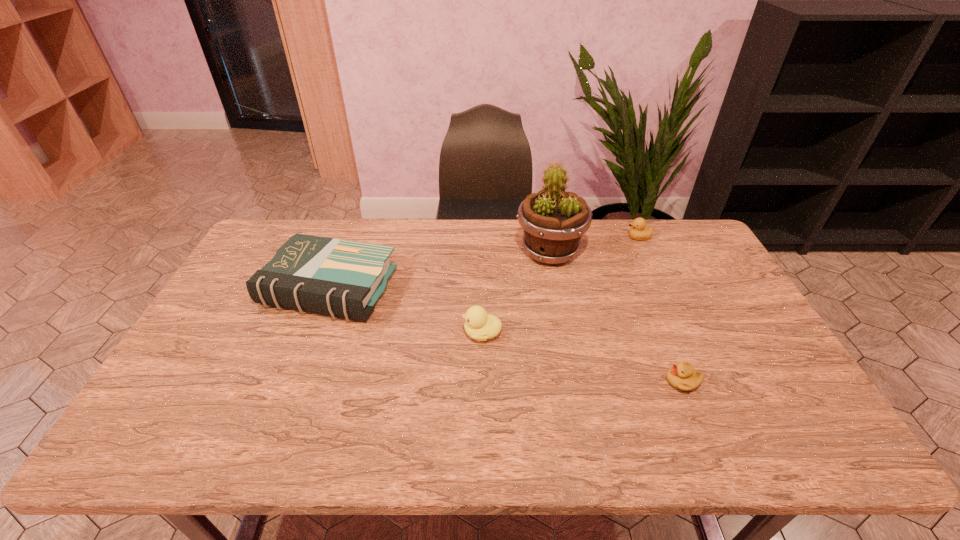
Image resolution: width=960 pixels, height=540 pixels. Identify the location of vacant area between the shortest object and the tallest duckling. (582, 357).

The height and width of the screenshot is (540, 960). I want to click on free area in between the flowerpot and the farthest duckling, so click(594, 245).

What are the coordinates of `empty space that is in between the flowerpot and the leftmost object` in the screenshot? It's located at (440, 270).

The height and width of the screenshot is (540, 960). What are the coordinates of `vacant space that's between the second shortest duckling and the shortest object` in the screenshot? It's located at (660, 309).

You are a GUI agent. You are given a task and a screenshot of the screen. Output one action in this format:
    pyautogui.click(x=<x>, y=<y>)
    Task: Click on the vacant point located between the second nearest duckling and the paperback book
    
    Given the screenshot: What is the action you would take?
    pyautogui.click(x=406, y=310)

The height and width of the screenshot is (540, 960). What are the coordinates of `free spot between the farthest duckling and the shortest object` in the screenshot? It's located at (660, 309).

You are a GUI agent. You are given a task and a screenshot of the screen. Output one action in this format:
    pyautogui.click(x=<x>, y=<y>)
    Task: Click on the free space between the leftmost duckling and the farthest duckling
    The image size is (960, 540).
    Given the screenshot: What is the action you would take?
    pyautogui.click(x=561, y=285)

This screenshot has width=960, height=540. In order to click on vacant space in between the farthest duckling and the third object from right to left in this screenshot , I will do `click(594, 245)`.

Identify the location of empty space that is in between the farthest duckling and the tallest object. This screenshot has width=960, height=540. click(x=594, y=245).

Where is `empty space that is in between the nearest object and the leftmost object`? This screenshot has height=540, width=960. empty space that is in between the nearest object and the leftmost object is located at coordinates (506, 335).